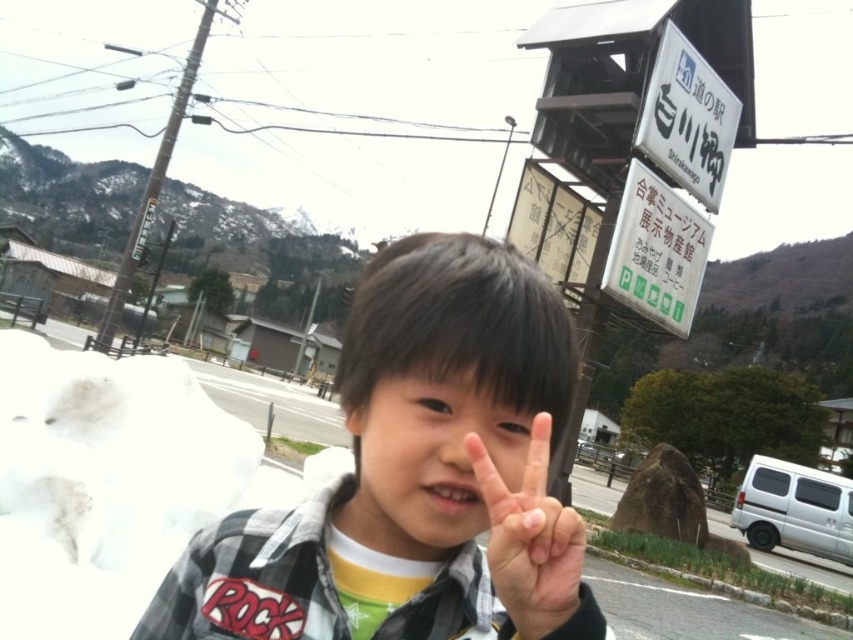
Between point (564, 609) and point (672, 252), which one is positioned in front?

Point (564, 609)

In the scene shown: Between smooth skin hand at center and white plastic sign at upper right, which one appears on the left side from the viewer's perspective?

Positioned to the left is smooth skin hand at center.

Does point (532, 513) come farther from viewer compared to point (671, 259)?

No, it is in front of (671, 259).

What are the coordinates of `smooth skin hand at center` in the screenshot? It's located at (527, 534).

Is white plastic sign at upper right bigger than white plastic sign at upper center?

Indeed, white plastic sign at upper right has a larger size compared to white plastic sign at upper center.

Can you confirm if white plastic sign at upper right is positioned to the left of white plastic sign at upper center?

Yes, white plastic sign at upper right is to the left of white plastic sign at upper center.

You are a GUI agent. You are given a task and a screenshot of the screen. Output one action in this format:
    pyautogui.click(x=<x>, y=<y>)
    Task: Click on the white plastic sign at upper right
    
    Given the screenshot: What is the action you would take?
    pyautogui.click(x=656, y=252)

Does point (463, 608) come in front of point (506, 560)?

No, it is behind (506, 560).

Is point (323, 502) farther from viewer compared to point (498, 561)?

Yes, point (323, 502) is farther from viewer.

Find the location of `plaid shirt at center`. plaid shirt at center is located at coordinates (416, 474).

Locate an element on the screen. The width and height of the screenshot is (853, 640). plaid shirt at center is located at coordinates (416, 474).